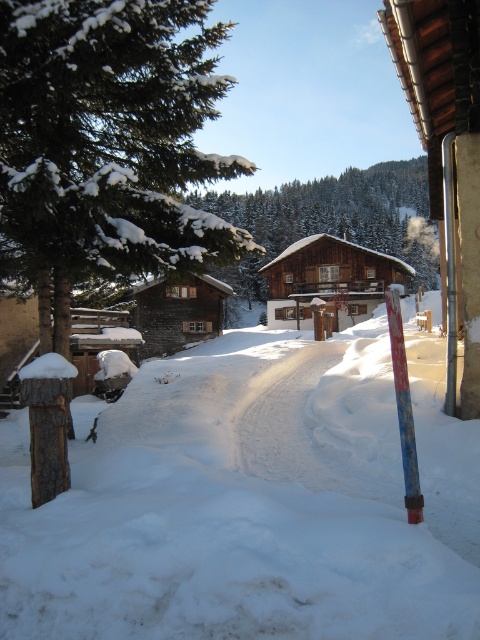
Question: Among these objects, which one is farthest from the camera?

Choices:
 (A) wooden hut at right
 (B) white fluffy snow at center
 (C) blue painted wood pole at lower right

Answer: (A)

Question: Which object is closer to the camera taking this photo?

Choices:
 (A) wooden cabin at center
 (B) white fluffy snow at center

Answer: (B)

Question: Does wooden hut at right have a larger size compared to wooden cabin at center?

Choices:
 (A) no
 (B) yes

Answer: (A)

Question: Which object appears farthest from the camera in this image?

Choices:
 (A) wooden cabin at center
 (B) green textured pine tree at left

Answer: (A)

Question: Is green textured pine tree at left above brown wooden cabin at center?

Choices:
 (A) no
 (B) yes

Answer: (B)

Question: Does white fluffy snow at center appear over green textured pine tree at left?

Choices:
 (A) yes
 (B) no

Answer: (B)